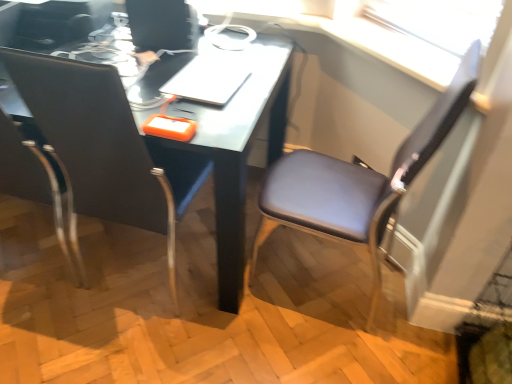
Where is `free space in front of black leather chair at left, the second chair viewed from the right`? free space in front of black leather chair at left, the second chair viewed from the right is located at coordinates (129, 344).